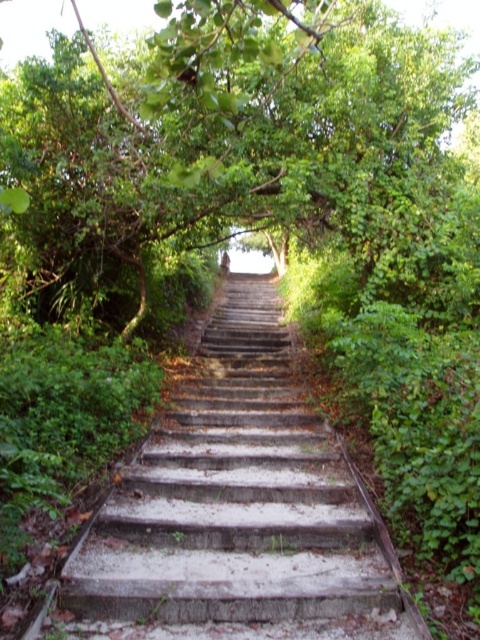
Question: Does concrete stairs at center appear over green leafy tree at center?

Choices:
 (A) yes
 (B) no

Answer: (B)

Question: Which object is closer to the camera taking this photo?

Choices:
 (A) green leafy tree at center
 (B) concrete stairs at center

Answer: (A)

Question: Is concrete stairs at center closer to the viewer compared to green leafy tree at center?

Choices:
 (A) yes
 (B) no

Answer: (B)

Question: Does concrete stairs at center appear under green leafy tree at center?

Choices:
 (A) yes
 (B) no

Answer: (A)